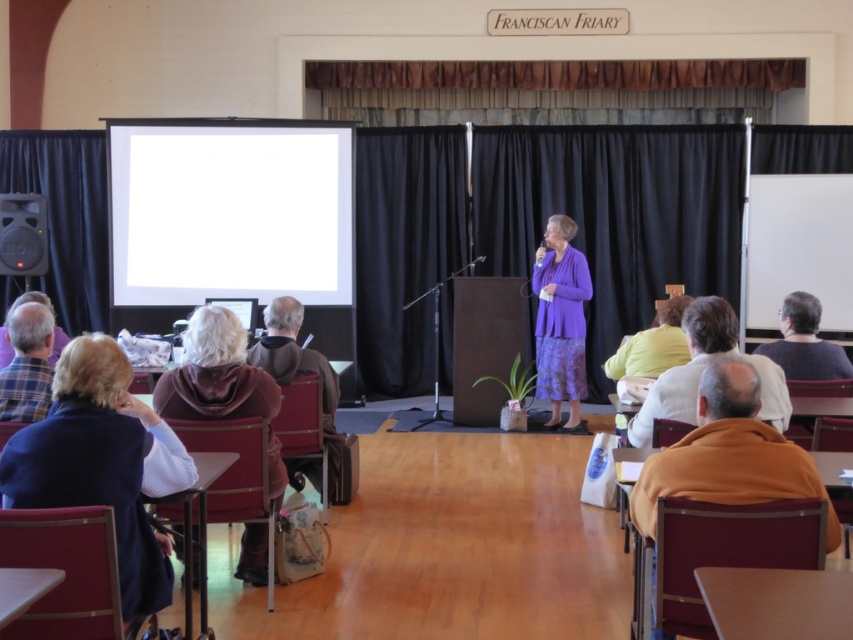
Does orange fleece at lower right have a greater width compared to yellow fabric at center?

Yes.

Consider the image. Is orange fleece at lower right positioned in front of yellow fabric at center?

Yes.

Locate an element on the screen. orange fleece at lower right is located at coordinates (728, 452).

Locate an element on the screen. This screenshot has height=640, width=853. orange fleece at lower right is located at coordinates pyautogui.click(x=728, y=452).

Does white glossy projection screen at upper left have a greater height compared to purple fabric dress at center?

In fact, white glossy projection screen at upper left may be shorter than purple fabric dress at center.

Is white glossy projection screen at upper left shorter than purple fabric dress at center?

Correct, white glossy projection screen at upper left is not as tall as purple fabric dress at center.

Which is in front, point (202, 221) or point (577, 308)?

Positioned in front is point (577, 308).

I want to click on white glossy projection screen at upper left, so click(x=230, y=212).

Is plaid fabric shirt at left bigger than yellow fabric at center?

Actually, plaid fabric shirt at left might be smaller than yellow fabric at center.

Does plaid fabric shirt at left appear over yellow fabric at center?

Incorrect, plaid fabric shirt at left is not positioned above yellow fabric at center.

Who is more forward, (13,340) or (631,356)?

Positioned in front is point (13,340).

In order to click on plaid fabric shirt at left in this screenshot , I will do `click(27, 365)`.